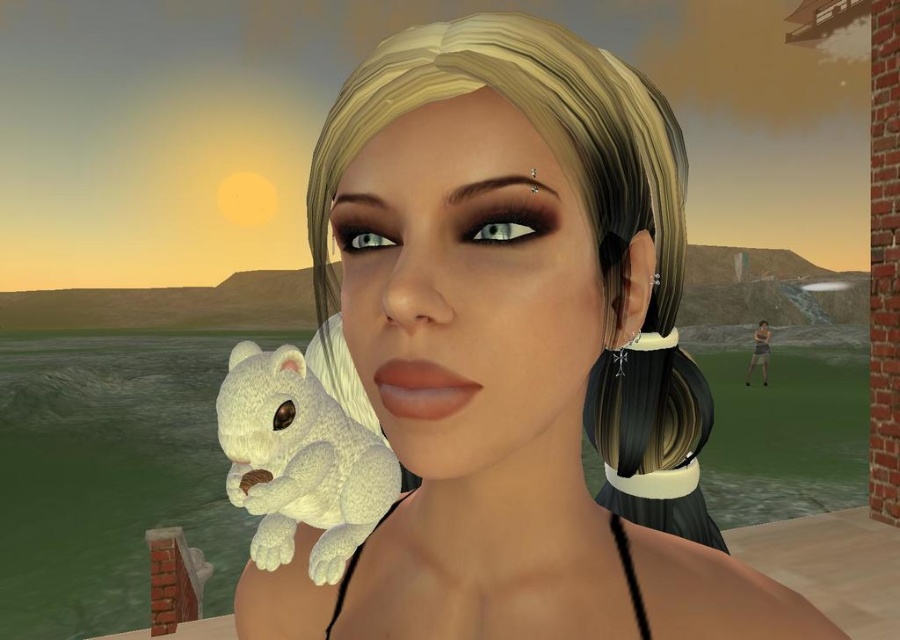
You are a character in the scene and want to grab the white plush bear at center and the white plush toy at center. Which one is closer to you?

The white plush bear at center is closer to you because it is in front of the white plush toy at center.

You are organizing a display of stuffed animals in a store and see the white plush bear at center and the white plush toy at center. Which one should you place on the right side of the display?

The white plush bear at center should be placed on the right side of the display because it is positioned on the right side of the white plush toy at center in the image.

You are a character in the scene and want to place both the white plush bear at center and the white plush toy at center on a shelf that is 10 inches wide. Can both items fit side by side on the shelf without overlapping?

The white plush bear at center is 6.84 inches from the white plush toy at center. Since the total distance between them is 6.84 inches and the shelf is 10 inches wide, there is enough space to place both items side by side without overlapping.